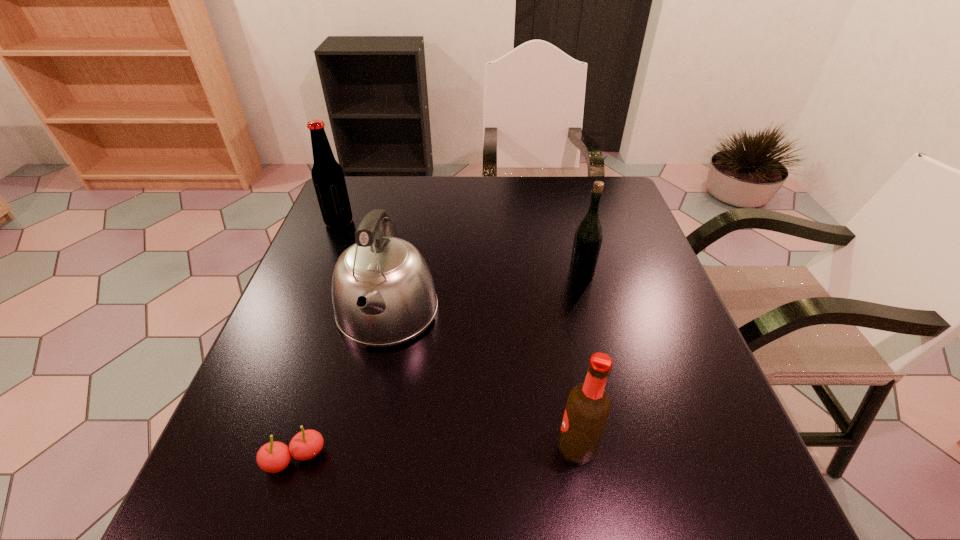
Locate an element on the screen. The width and height of the screenshot is (960, 540). vacant region at the far edge of the desktop is located at coordinates (423, 205).

This screenshot has height=540, width=960. In order to click on vacant area at the near edge in this screenshot , I will do `click(579, 498)`.

This screenshot has height=540, width=960. Find the location of `vacant space at the left edge`. vacant space at the left edge is located at coordinates (284, 358).

In the image, there is a desktop. Identify the location of vacant space at the right edge. (667, 355).

Locate an element on the screen. Image resolution: width=960 pixels, height=540 pixels. vacant point at the far left corner is located at coordinates (358, 208).

The width and height of the screenshot is (960, 540). In order to click on blank space at the near left corner of the desktop in this screenshot , I will do `click(242, 501)`.

You are a GUI agent. You are given a task and a screenshot of the screen. Output one action in this format:
    pyautogui.click(x=<x>, y=<y>)
    Task: Click on the vacant space at the far right corner of the desktop
    The image size is (960, 540).
    Given the screenshot: What is the action you would take?
    (x=627, y=199)

The image size is (960, 540). In order to click on vacant area between the cherry and the farthest beer bottle in this screenshot , I will do `click(317, 340)`.

Identify the location of free point between the farthest beer bottle and the second nearest beer bottle. (460, 248).

This screenshot has width=960, height=540. Find the location of `free space that is in between the second beer bottle from left to right and the farthest object`. free space that is in between the second beer bottle from left to right and the farthest object is located at coordinates (458, 334).